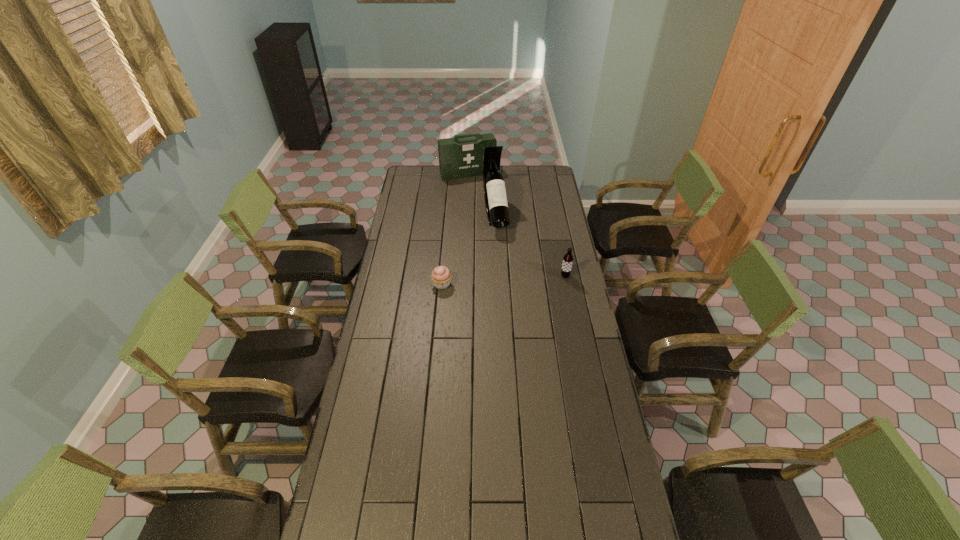
Where is `free spot on the desktop that is between the cupcake and the second shortest object and is positioned on the stand of the second farthest object`? The height and width of the screenshot is (540, 960). free spot on the desktop that is between the cupcake and the second shortest object and is positioned on the stand of the second farthest object is located at coordinates (513, 280).

Where is `free space on the desktop that is between the cupcake and the rightmost object and is positioned on the front-facing side of the second tallest object`? The height and width of the screenshot is (540, 960). free space on the desktop that is between the cupcake and the rightmost object and is positioned on the front-facing side of the second tallest object is located at coordinates click(515, 280).